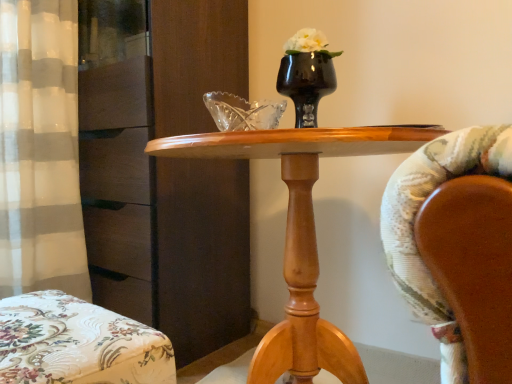
Question: From the image's perspective, is black glossy vase at center under wooden table at center?

Choices:
 (A) no
 (B) yes

Answer: (A)

Question: Is black glossy vase at center closer to the viewer compared to wooden table at center?

Choices:
 (A) yes
 (B) no

Answer: (B)

Question: Is black glossy vase at center behind wooden table at center?

Choices:
 (A) no
 (B) yes

Answer: (B)

Question: Does black glossy vase at center appear on the right side of wooden table at center?

Choices:
 (A) no
 (B) yes

Answer: (B)

Question: Is black glossy vase at center taller than wooden table at center?

Choices:
 (A) yes
 (B) no

Answer: (B)

Question: Is there a large distance between black glossy vase at center and wooden table at center?

Choices:
 (A) yes
 (B) no

Answer: (B)

Question: Is black glossy vase at center positioned with its back to floral fabric ottoman at lower left?

Choices:
 (A) yes
 (B) no

Answer: (B)

Question: Considering the relative sizes of black glossy vase at center and floral fabric ottoman at lower left in the image provided, is black glossy vase at center taller than floral fabric ottoman at lower left?

Choices:
 (A) no
 (B) yes

Answer: (B)

Question: Can floral fabric ottoman at lower left be found inside black glossy vase at center?

Choices:
 (A) yes
 (B) no

Answer: (B)

Question: Is black glossy vase at center shorter than floral fabric ottoman at lower left?

Choices:
 (A) yes
 (B) no

Answer: (B)

Question: Is black glossy vase at center to the right of floral fabric ottoman at lower left from the viewer's perspective?

Choices:
 (A) no
 (B) yes

Answer: (B)

Question: From the image's perspective, would you say black glossy vase at center is shown under floral fabric ottoman at lower left?

Choices:
 (A) no
 (B) yes

Answer: (A)

Question: Does wooden table at center have a larger size compared to floral fabric ottoman at lower left?

Choices:
 (A) no
 (B) yes

Answer: (B)